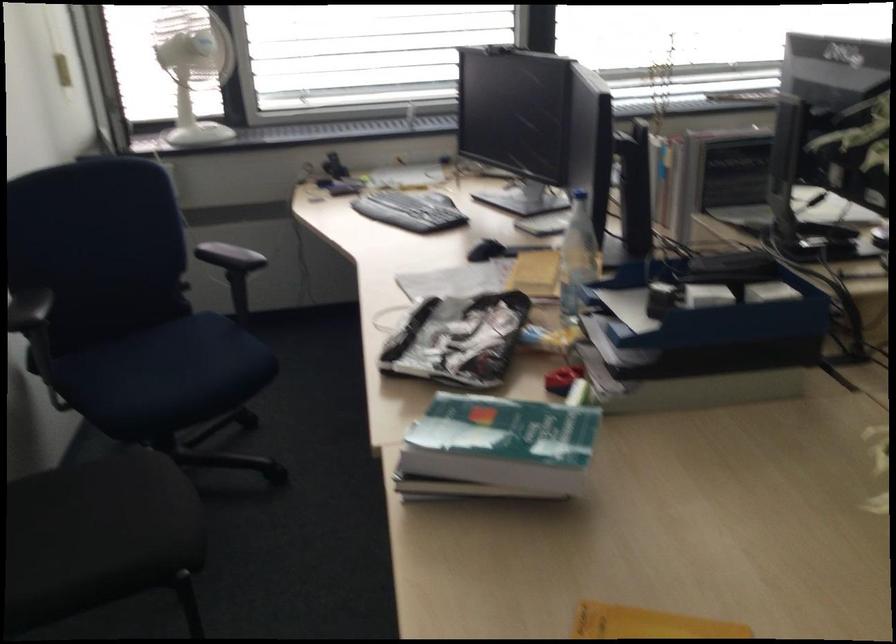
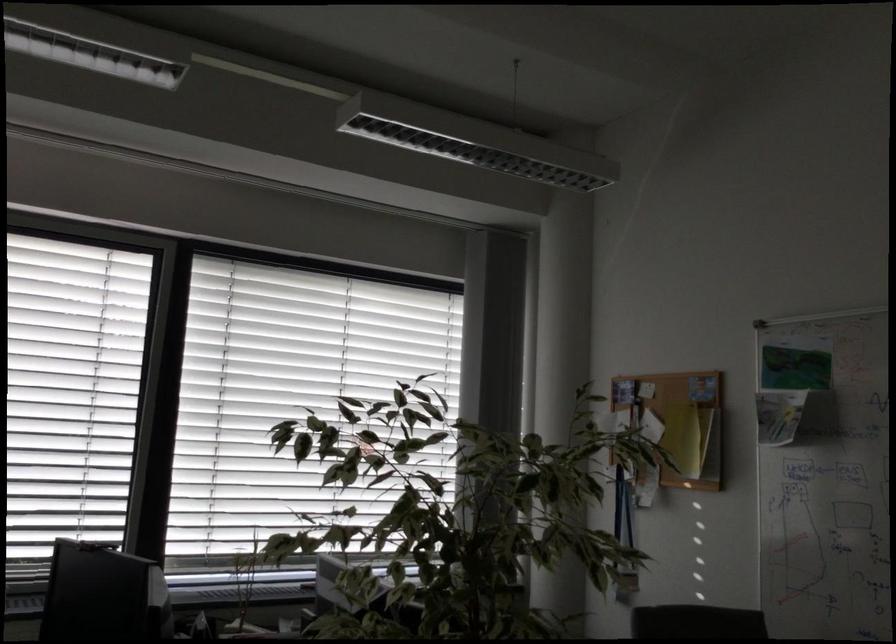
The first image is from the beginning of the video and the second image is from the end. How did the camera likely rotate when shooting the video?

The rotation direction of the camera is right-up.